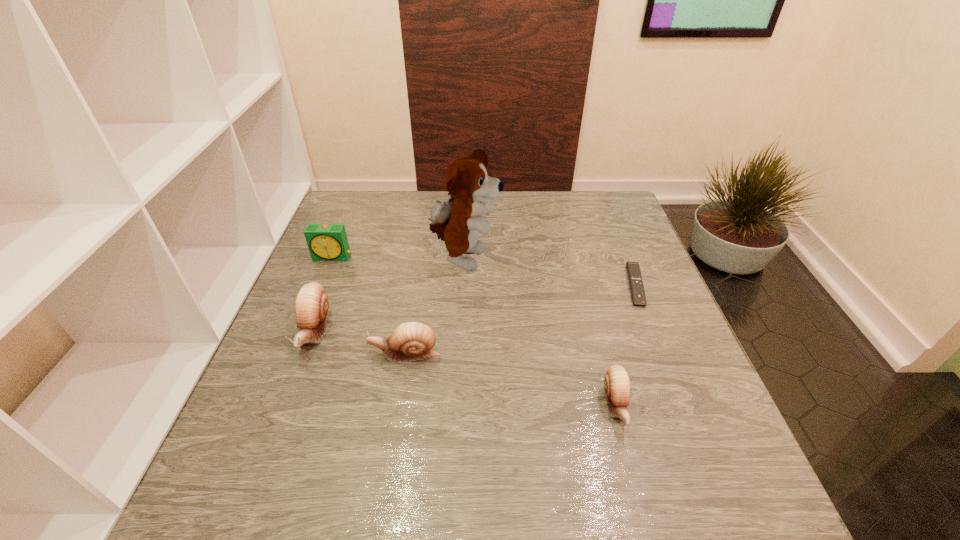
Image resolution: width=960 pixels, height=540 pixels. What are the coordinates of `the leftmost escargot` in the screenshot? It's located at (311, 304).

Locate an element on the screen. This screenshot has height=540, width=960. the second shortest escargot is located at coordinates (410, 341).

The height and width of the screenshot is (540, 960). I want to click on the second object from right to left, so pos(617,385).

Locate an element on the screen. The height and width of the screenshot is (540, 960). the nearest escargot is located at coordinates (617, 385).

Image resolution: width=960 pixels, height=540 pixels. I want to click on alarm clock, so click(x=327, y=242).

This screenshot has height=540, width=960. I want to click on the tallest object, so click(457, 221).

Identify the location of remote control. (633, 270).

The height and width of the screenshot is (540, 960). In order to click on the rightmost object in this screenshot , I will do `click(633, 270)`.

Find the location of a particular element. This screenshot has height=540, width=960. vacant space located 0.120m on the front-facing side of the leftmost escargot is located at coordinates (283, 414).

Identify the location of free space located on the front-facing side of the second escargot from left to right. The image size is (960, 540). (272, 354).